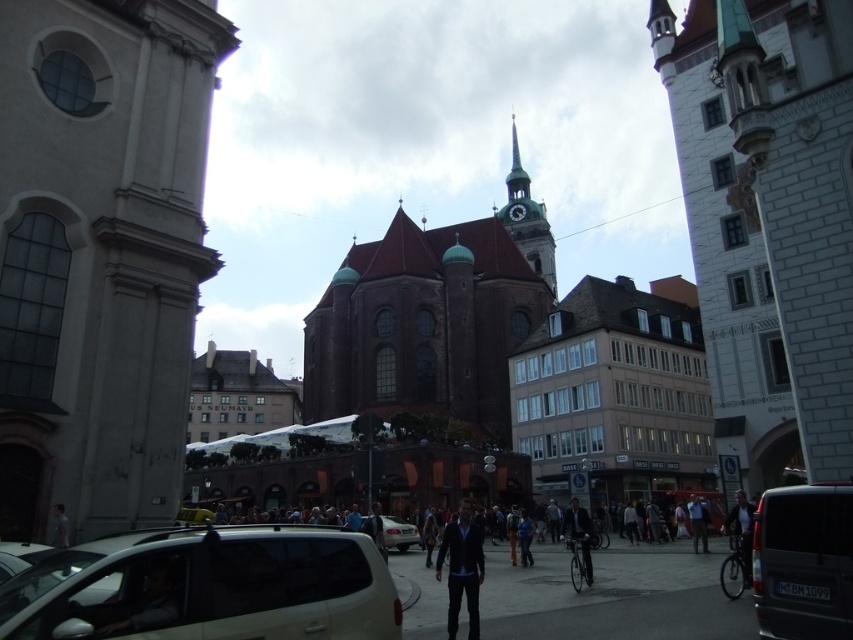
Is point (844, 147) positioned behind point (457, 524)?

Yes, point (844, 147) is farther from viewer.

Which is below, white stone tower at right or dark blue fabric jacket at center?

dark blue fabric jacket at center

What do you see at coordinates (769, 220) in the screenshot?
I see `white stone tower at right` at bounding box center [769, 220].

This screenshot has width=853, height=640. In order to click on white stone tower at right in this screenshot , I will do `click(769, 220)`.

Does dark blue suit at center have a lesser width compared to dark blue jacket at center?

Incorrect, dark blue suit at center's width is not less than dark blue jacket at center's.

Who is higher up, dark blue suit at center or dark blue jacket at center?

Positioned higher is dark blue jacket at center.

Measure the distance between point (573, 508) and camera.

Point (573, 508) is 47.68 meters away from camera.

You are a GUI agent. You are given a task and a screenshot of the screen. Output one action in this format:
    pyautogui.click(x=<x>, y=<y>)
    Task: Click on the dark blue suit at center
    This screenshot has height=640, width=853.
    Given the screenshot: What is the action you would take?
    pyautogui.click(x=579, y=536)

Does white matte van at center have a greater height compared to light blue shirt at center?

Correct, white matte van at center is much taller as light blue shirt at center.

Who is more distant from viewer, (90, 598) or (698, 524)?

Point (698, 524)

The image size is (853, 640). In order to click on white matte van at center in this screenshot , I will do `click(207, 588)`.

You are a GUI agent. You are given a task and a screenshot of the screen. Output one action in this format:
    pyautogui.click(x=<x>, y=<y>)
    Task: Click on the white matte van at center
    
    Given the screenshot: What is the action you would take?
    pyautogui.click(x=207, y=588)